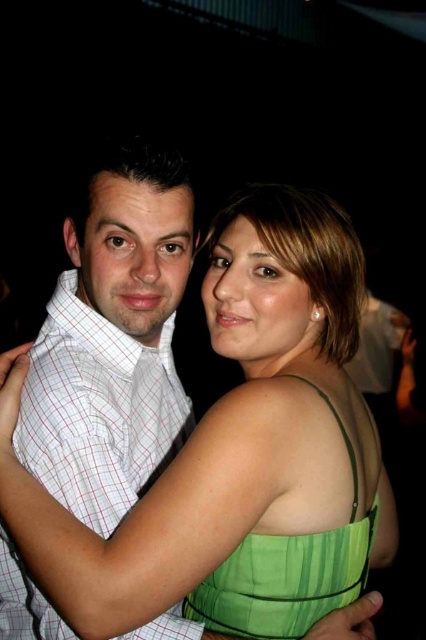
Which is behind, point (146, 541) or point (209, 592)?

Point (209, 592)

Where is `green satin dress at center`? green satin dress at center is located at coordinates (238, 454).

Can you confirm if green satin dress at center is positioned below white checkered shirt at center?

Actually, green satin dress at center is above white checkered shirt at center.

Is green satin dress at center smaller than white checkered shirt at center?

Incorrect, green satin dress at center is not smaller in size than white checkered shirt at center.

Who is more distant from viewer, (207,564) or (154,625)?

The point (154,625) is more distant.

Locate an element on the screen. The image size is (426, 640). green satin dress at center is located at coordinates tap(238, 454).

Does white checkered shirt at center have a greater height compared to green satin dress at upper right?

Yes.

Who is more distant from viewer, (109, 333) or (302, 624)?

Positioned behind is point (109, 333).

What are the coordinates of `white checkered shirt at center` in the screenshot? It's located at (97, 410).